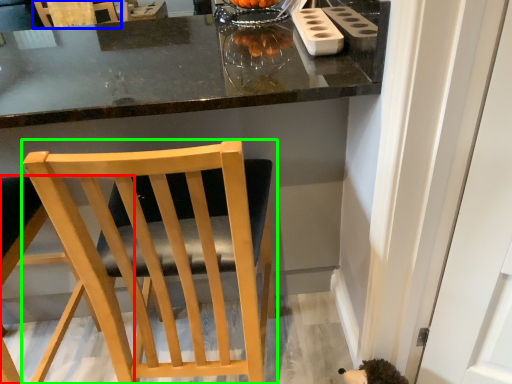
Question: Considering the real-world distances, which object is farthest from chair (highlighted by a red box)? chair (highlighted by a blue box) or chair (highlighted by a green box)?

Choices:
 (A) chair
 (B) chair

Answer: (A)